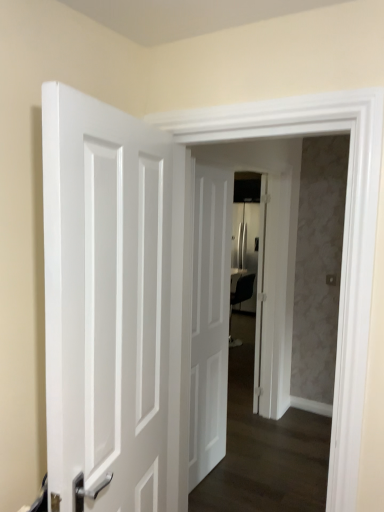
Question: Is white glossy door at center, the first door when ordered from right to left, positioned behind white glossy door at left, marked as the first door in a left-to-right arrangement?

Choices:
 (A) yes
 (B) no

Answer: (A)

Question: Can you confirm if white glossy door at center, placed as the first door when sorted from back to front, is positioned to the left of white glossy door at left, the first door when ordered from front to back?

Choices:
 (A) yes
 (B) no

Answer: (B)

Question: Does white glossy door at center, positioned as the third door in left-to-right order, have a greater height compared to white glossy door at left, placed as the third door when sorted from right to left?

Choices:
 (A) no
 (B) yes

Answer: (B)

Question: Could white glossy door at left, placed as the third door when sorted from right to left, be considered to be inside white glossy door at center, positioned as the third door in left-to-right order?

Choices:
 (A) yes
 (B) no

Answer: (B)

Question: Does white glossy door at center, placed as the first door when sorted from back to front, have a lesser height compared to white glossy door at left, placed as the third door when sorted from right to left?

Choices:
 (A) no
 (B) yes

Answer: (A)

Question: Do you think white matte door at center, placed as the second door when sorted from right to left, is within white glossy door at left, the third door when ordered from back to front, or outside of it?

Choices:
 (A) inside
 (B) outside

Answer: (B)

Question: Considering the positions of point (206, 365) and point (96, 204), is point (206, 365) closer or farther from the camera than point (96, 204)?

Choices:
 (A) closer
 (B) farther

Answer: (B)

Question: From a real-world perspective, is white matte door at center, placed as the second door when sorted from right to left, above or below white glossy door at left, marked as the first door in a left-to-right arrangement?

Choices:
 (A) below
 (B) above

Answer: (A)

Question: From the image's perspective, relative to white glossy door at left, placed as the third door when sorted from right to left, is white matte door at center, positioned as the 2th door in left-to-right order, above or below?

Choices:
 (A) above
 (B) below

Answer: (B)

Question: Considering the positions of white glossy door at center and white glossy door at center, the first door when ordered from right to left, in the image, is white glossy door at center bigger or smaller than white glossy door at center, the first door when ordered from right to left,?

Choices:
 (A) big
 (B) small

Answer: (A)

Question: Is white glossy door at center inside or outside of white glossy door at center, positioned as the third door in left-to-right order?

Choices:
 (A) inside
 (B) outside

Answer: (B)

Question: From the image's perspective, relative to white glossy door at center, the third door in the front-to-back sequence, is white glossy door at center above or below?

Choices:
 (A) below
 (B) above

Answer: (A)

Question: Considering their positions, is white glossy door at center located in front of or behind white glossy door at center, placed as the first door when sorted from back to front?

Choices:
 (A) front
 (B) behind

Answer: (A)

Question: From the image's perspective, is white glossy door at center above or below white matte door at center, placed as the second door when sorted from right to left?

Choices:
 (A) above
 (B) below

Answer: (A)

Question: In terms of height, does white glossy door at center look taller or shorter compared to white matte door at center, placed as the second door when sorted from back to front?

Choices:
 (A) tall
 (B) short

Answer: (A)